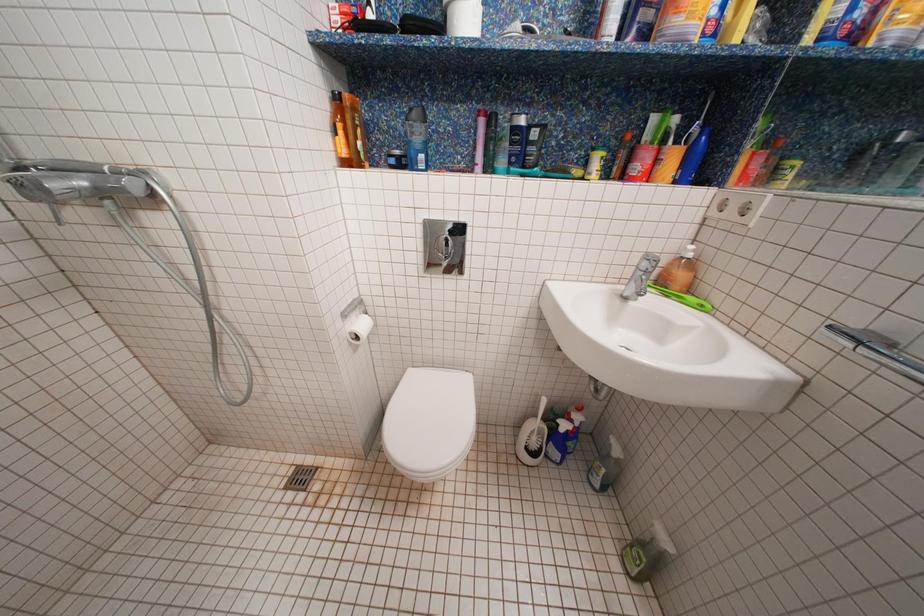
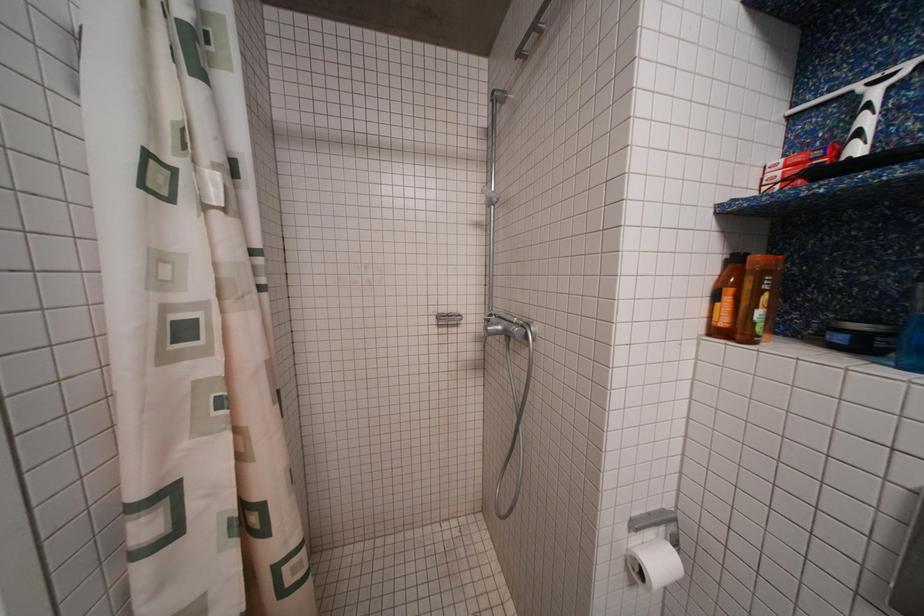
Question: The camera is either moving clockwise (left) or counter-clockwise (right) around the object. The first image is from the beginning of the video and the second image is from the end. Is the camera moving left or right when shooting the video?

Choices:
 (A) Left
 (B) Right

Answer: (B)